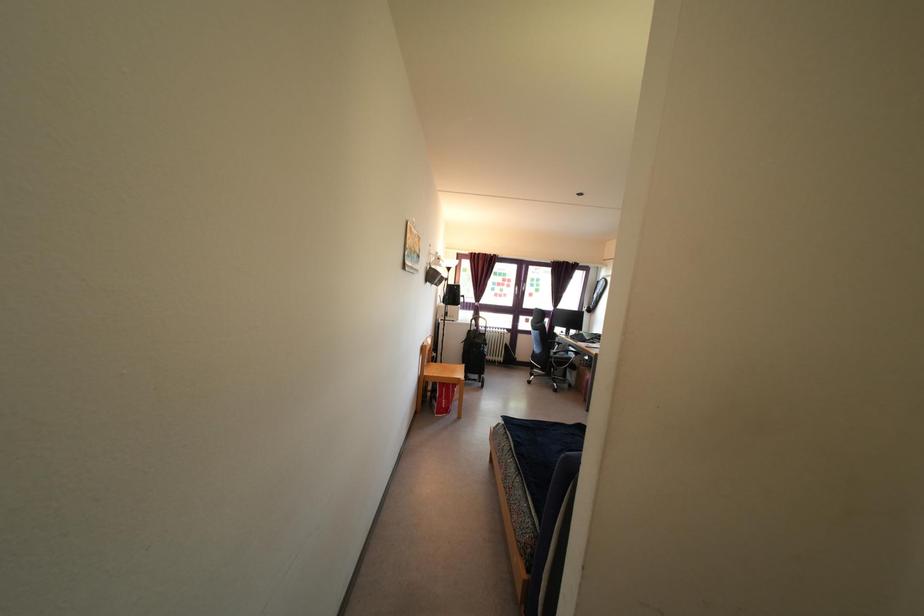
This screenshot has height=616, width=924. What do you see at coordinates (475, 351) in the screenshot? I see `the black trolley handle` at bounding box center [475, 351].